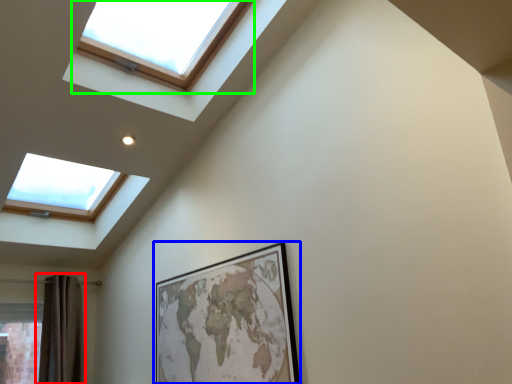
Question: Based on their relative distances, which object is farther from shower curtain (highlighted by a red box)? Choose from picture frame (highlighted by a blue box) and window (highlighted by a green box).

Choices:
 (A) picture frame
 (B) window

Answer: (B)